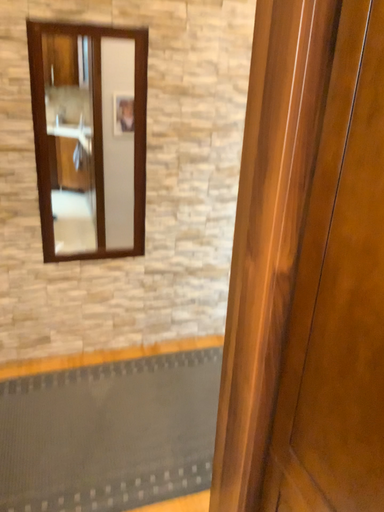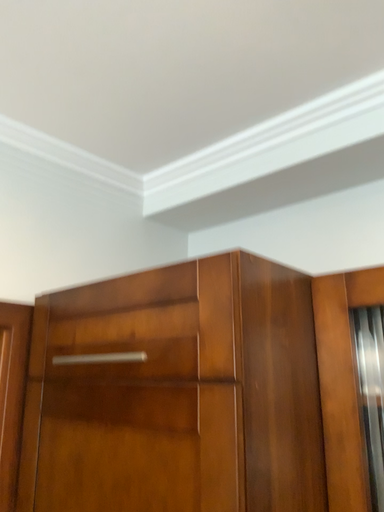
Question: Which way did the camera rotate in the video?

Choices:
 (A) rotated left
 (B) rotated right

Answer: (B)